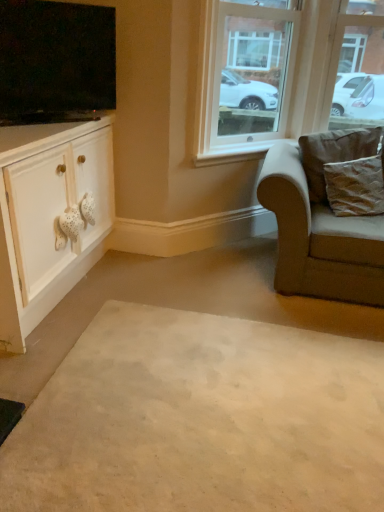
Find the location of `free location in front of beige fabric chair at right`. free location in front of beige fabric chair at right is located at coordinates (305, 342).